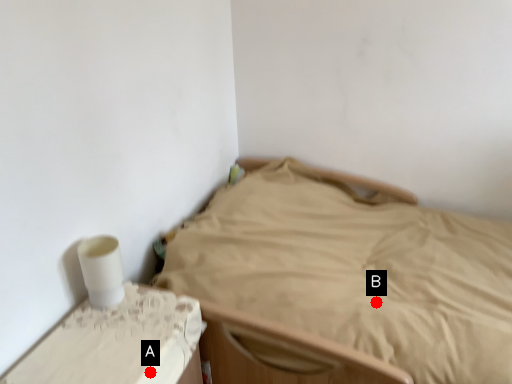
Question: Two points are circled on the image, labeled by A and B beside each circle. Which of the following is the closest to the observer?

Choices:
 (A) A is closer
 (B) B is closer

Answer: (A)